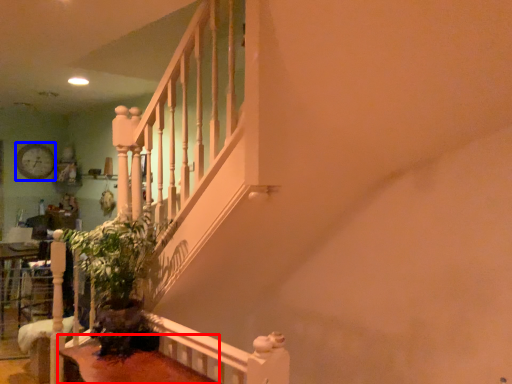
Question: Which object is closer to the camera taking this photo, table (highlighted by a red box) or clock (highlighted by a blue box)?

Choices:
 (A) table
 (B) clock

Answer: (A)